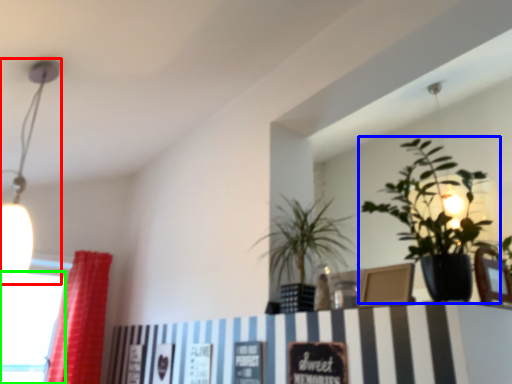
Question: Based on their relative distances, which object is farther from lamp (highlighted by a red box)? Choose from houseplant (highlighted by a blue box) and window (highlighted by a green box).

Choices:
 (A) houseplant
 (B) window

Answer: (A)